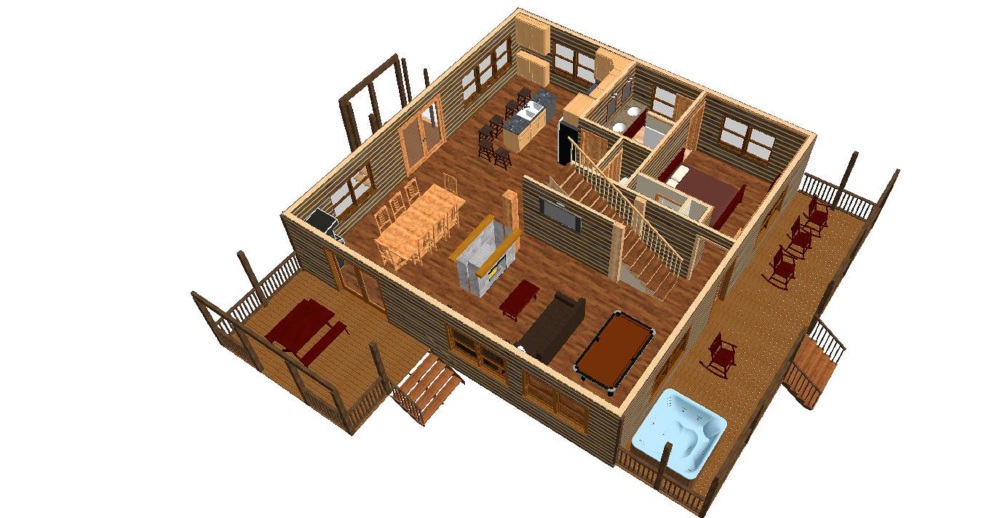
This screenshot has width=1000, height=518. In order to click on side door in this screenshot , I will do `click(371, 284)`.